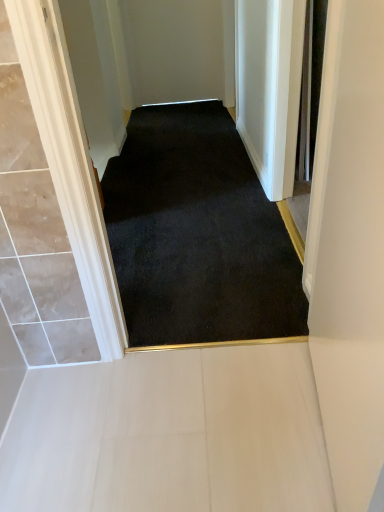
You are a GUI agent. You are given a task and a screenshot of the screen. Output one action in this format:
    pyautogui.click(x=<x>, y=<y>)
    Task: Click on the free space above white tile floor at lower center (from a real-world perspective)
    
    Given the screenshot: What is the action you would take?
    (175, 415)